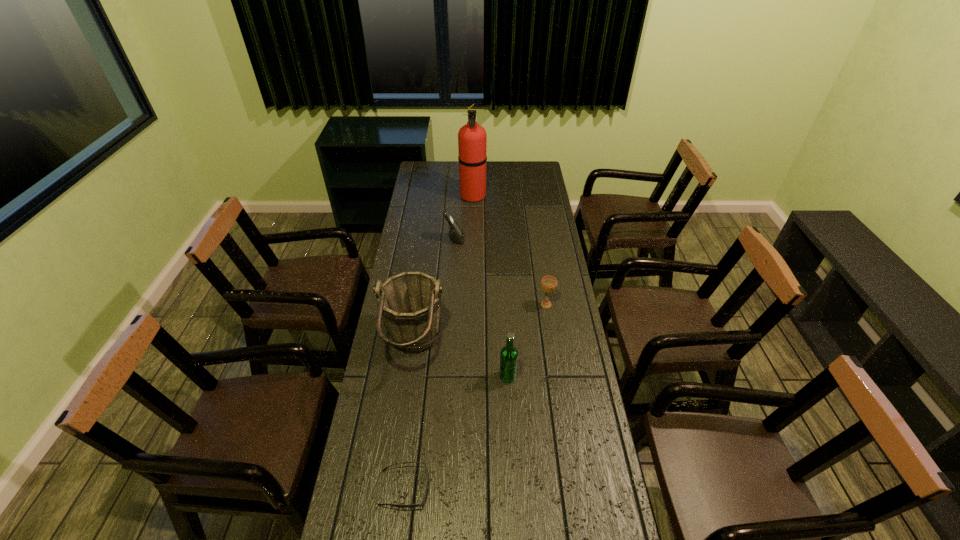
I want to click on sunglasses, so click(x=421, y=504).

Find the location of a particular element. The height and width of the screenshot is (540, 960). blank space located 0.280m at the nozzle of the farthest object is located at coordinates (540, 195).

Where is `vacant space located on the handle side of the bucket`? vacant space located on the handle side of the bucket is located at coordinates 525,346.

Locate an element on the screen. vacant space located 0.350m on the back of the fifth object from left to right is located at coordinates (503, 298).

Where is `free region located on the front-facing side of the fourth tallest object`? free region located on the front-facing side of the fourth tallest object is located at coordinates (522, 240).

Find the location of a particular element. This screenshot has width=960, height=540. vacant area situated 0.310m on the back of the fifth tallest object is located at coordinates (538, 251).

Locate an element on the screen. The image size is (960, 540). free space located 0.390m on the front-facing side of the shortest object is located at coordinates (567, 488).

What are the coordinates of `bucket present at the left edge` in the screenshot? It's located at (410, 302).

The height and width of the screenshot is (540, 960). In order to click on sunglasses at the left edge in this screenshot , I will do `click(421, 504)`.

Identify the location of object present at the right edge. Image resolution: width=960 pixels, height=540 pixels. (548, 283).